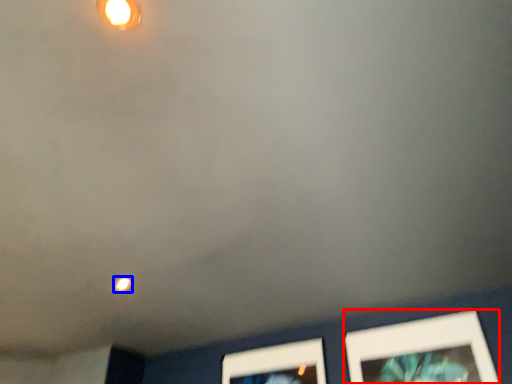
Question: Among these objects, which one is nearest to the camera, picture frame (highlighted by a red box) or light (highlighted by a blue box)?

Choices:
 (A) picture frame
 (B) light

Answer: (A)